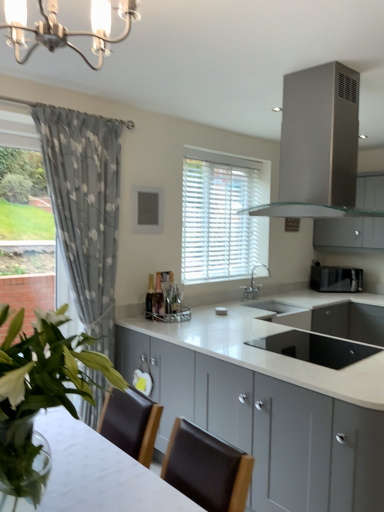
Question: Is stainless steel range hood at upper center next to satin silver cabinet at upper right, which is the 1th cabinetry in back-to-front order, and touching it?

Choices:
 (A) no
 (B) yes

Answer: (A)

Question: Does stainless steel range hood at upper center have a lesser height compared to satin silver cabinet at upper right, which is the 1th cabinetry in back-to-front order?

Choices:
 (A) no
 (B) yes

Answer: (B)

Question: From a real-world perspective, is stainless steel range hood at upper center located higher than satin silver cabinet at upper right, placed as the first cabinetry when sorted from top to bottom?

Choices:
 (A) no
 (B) yes

Answer: (B)

Question: Does stainless steel range hood at upper center contain satin silver cabinet at upper right, which is counted as the second cabinetry, starting from the bottom?

Choices:
 (A) no
 (B) yes

Answer: (A)

Question: Is stainless steel range hood at upper center not near satin silver cabinet at upper right, placed as the first cabinetry when sorted from top to bottom?

Choices:
 (A) no
 (B) yes

Answer: (B)

Question: Visually, is satin silver cabinet at upper right, the 2th cabinetry when ordered from front to back, positioned to the left or to the right of black matte toaster at right, the first appliance positioned from the top?

Choices:
 (A) left
 (B) right

Answer: (B)

Question: Considering the positions of satin silver cabinet at upper right, positioned as the first cabinetry in right-to-left order, and black matte toaster at right, the 2th appliance positioned from the bottom, in the image, is satin silver cabinet at upper right, positioned as the first cabinetry in right-to-left order, wider or thinner than black matte toaster at right, the 2th appliance positioned from the bottom,?

Choices:
 (A) thin
 (B) wide

Answer: (B)

Question: Is satin silver cabinet at upper right, which is counted as the second cabinetry, starting from the bottom, inside or outside of black matte toaster at right, which is the 1th appliance from back to front?

Choices:
 (A) inside
 (B) outside

Answer: (B)

Question: In terms of height, does satin silver cabinet at upper right, which is counted as the second cabinetry, starting from the bottom, look taller or shorter compared to black matte toaster at right, marked as the 1th appliance in a right-to-left arrangement?

Choices:
 (A) short
 (B) tall

Answer: (B)

Question: From the image's perspective, relative to green leafy plant at center, is black glass sink at center, which ranks as the 1th appliance in front-to-back order, above or below?

Choices:
 (A) above
 (B) below

Answer: (B)

Question: Choose the correct answer: Is black glass sink at center, which is the first appliance in left-to-right order, inside green leafy plant at center or outside it?

Choices:
 (A) inside
 (B) outside

Answer: (B)

Question: From a real-world perspective, is black glass sink at center, marked as the 2th appliance in a right-to-left arrangement, positioned above or below green leafy plant at center?

Choices:
 (A) below
 (B) above

Answer: (A)

Question: Looking at the image, does black glass sink at center, which ranks as the 1th appliance in front-to-back order, seem bigger or smaller compared to green leafy plant at center?

Choices:
 (A) big
 (B) small

Answer: (B)

Question: From a real-world perspective, relative to silver metallic faucet at center, is white blinds at center vertically above or below?

Choices:
 (A) below
 (B) above

Answer: (B)

Question: Considering the positions of point (235, 175) and point (253, 267), is point (235, 175) closer or farther from the camera than point (253, 267)?

Choices:
 (A) farther
 (B) closer

Answer: (B)